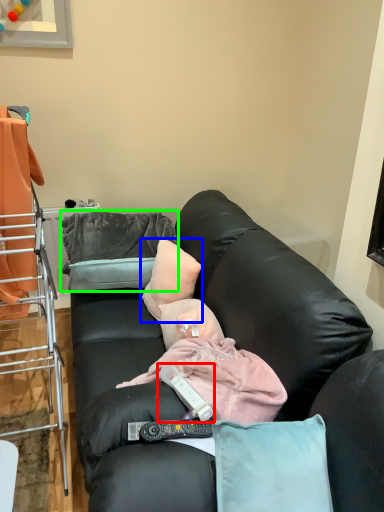
Question: Considering the real-world distances, which object is farthest from remote control (highlighted by a red box)? pillow (highlighted by a blue box) or pillow (highlighted by a green box)?

Choices:
 (A) pillow
 (B) pillow

Answer: (B)